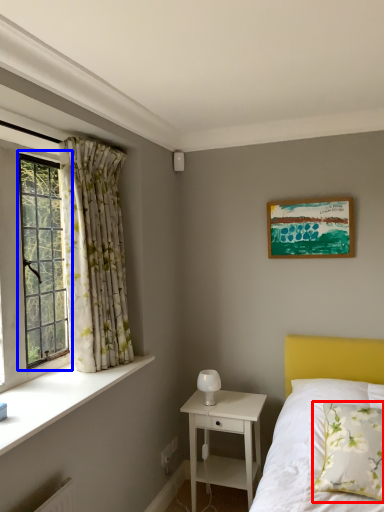
Question: Which object appears closest to the camera in this image, pillow (highlighted by a red box) or window (highlighted by a blue box)?

Choices:
 (A) pillow
 (B) window

Answer: (A)